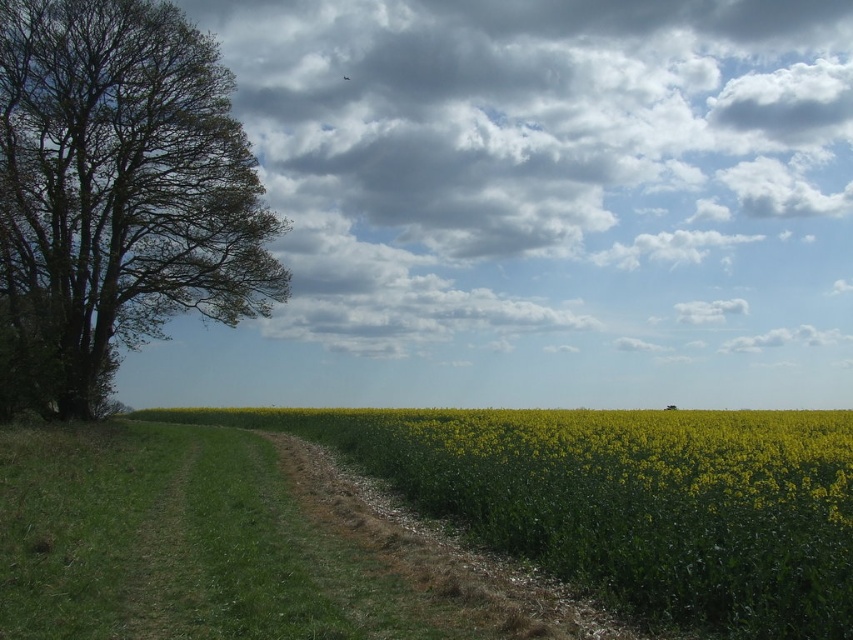
Consider the image. Is cloudy sky at upper center positioned before green leafy tree at left?

No, it is behind green leafy tree at left.

Can you confirm if cloudy sky at upper center is shorter than green leafy tree at left?

No.

The height and width of the screenshot is (640, 853). What do you see at coordinates (544, 161) in the screenshot?
I see `cloudy sky at upper center` at bounding box center [544, 161].

Where is `cloudy sky at upper center`? This screenshot has height=640, width=853. cloudy sky at upper center is located at coordinates (544, 161).

From the picture: Is cloudy sky at upper center positioned behind brown gravel path at center?

Yes.

Can you confirm if cloudy sky at upper center is bigger than brown gravel path at center?

Indeed, cloudy sky at upper center has a larger size compared to brown gravel path at center.

The height and width of the screenshot is (640, 853). Identify the location of cloudy sky at upper center. (544, 161).

Who is positioned more to the right, green leafy tree at left or brown gravel path at center?

brown gravel path at center is more to the right.

Can you confirm if green leafy tree at left is bigger than brown gravel path at center?

Correct, green leafy tree at left is larger in size than brown gravel path at center.

Where is `green leafy tree at left`? The width and height of the screenshot is (853, 640). green leafy tree at left is located at coordinates (117, 195).